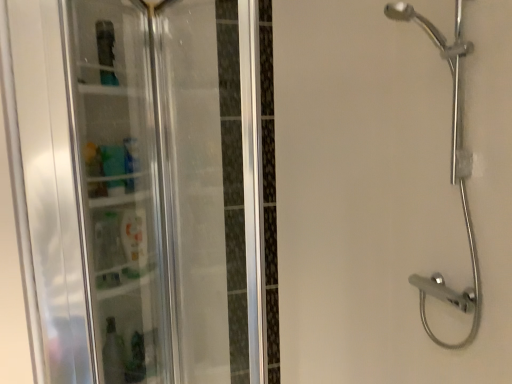
The image size is (512, 384). What do you see at coordinates (119, 186) in the screenshot?
I see `transparent plastic shelf at left` at bounding box center [119, 186].

Find the location of a particular element. transparent plastic shelf at left is located at coordinates (119, 186).

Measure the distance between transparent plastic shelf at left and camera.

transparent plastic shelf at left and camera are 3.75 feet apart.

The height and width of the screenshot is (384, 512). Describe the element at coordinates (450, 174) in the screenshot. I see `chrome metallic shower head at right` at that location.

At what (x,y) coordinates should I click in order to perform the action: click on chrome metallic shower head at right. Please return your answer as a coordinate pair (x, y). This screenshot has width=512, height=384. Looking at the image, I should click on (450, 174).

Locate an element on the screen. The height and width of the screenshot is (384, 512). transparent plastic shelf at left is located at coordinates (119, 186).

Which is more to the left, chrome metallic shower head at right or transparent plastic shelf at left?

transparent plastic shelf at left.

Based on the photo, is chrome metallic shower head at right in front of transparent plastic shelf at left?

No, it is behind transparent plastic shelf at left.

Which is farther from the camera, (462, 299) or (89, 254)?

The point (462, 299) is more distant.

From the image's perspective, who appears lower, chrome metallic shower head at right or transparent plastic shelf at left?

transparent plastic shelf at left.

From a real-world perspective, is chrome metallic shower head at right on top of transparent plastic shelf at left?

Correct, in the physical world, chrome metallic shower head at right is higher than transparent plastic shelf at left.

Which object is wider, chrome metallic shower head at right or transparent plastic shelf at left?

transparent plastic shelf at left is wider.

Does chrome metallic shower head at right have a lesser height compared to transparent plastic shelf at left?

No.

Considering the sizes of chrome metallic shower head at right and transparent plastic shelf at left in the image, is chrome metallic shower head at right bigger or smaller than transparent plastic shelf at left?

chrome metallic shower head at right is bigger than transparent plastic shelf at left.

Can we say chrome metallic shower head at right lies outside transparent plastic shelf at left?

Yes, chrome metallic shower head at right is outside of transparent plastic shelf at left.

Does chrome metallic shower head at right touch transparent plastic shelf at left?

No, chrome metallic shower head at right is not with transparent plastic shelf at left.

Could you tell me if chrome metallic shower head at right is facing transparent plastic shelf at left?

Yes.

What's the angular difference between chrome metallic shower head at right and transparent plastic shelf at left's facing directions?

The angular difference between chrome metallic shower head at right and transparent plastic shelf at left is 64.2 degrees.

Image resolution: width=512 pixels, height=384 pixels. Identify the location of screen door below the chrome metallic shower head at right (from the image's perspective). (119, 186).

Between transparent plastic shelf at left and chrome metallic shower head at right, which one appears on the left side from the viewer's perspective?

Positioned to the left is transparent plastic shelf at left.

Does transparent plastic shelf at left come in front of chrome metallic shower head at right?

Yes, transparent plastic shelf at left is closer to the viewer.

Which point is more forward, (72, 15) or (435, 336)?

Point (72, 15)

From the image's perspective, does transparent plastic shelf at left appear higher than chrome metallic shower head at right?

Incorrect, from the image's perspective, transparent plastic shelf at left is lower than chrome metallic shower head at right.

From a real-world perspective, which object stands above the other?

In real-world perspective, chrome metallic shower head at right is above.

Is transparent plastic shelf at left wider or thinner than chrome metallic shower head at right?

Clearly, transparent plastic shelf at left has more width compared to chrome metallic shower head at right.

Considering the sizes of objects transparent plastic shelf at left and chrome metallic shower head at right in the image provided, who is taller, transparent plastic shelf at left or chrome metallic shower head at right?

With more height is chrome metallic shower head at right.

Considering the relative sizes of transparent plastic shelf at left and chrome metallic shower head at right in the image provided, is transparent plastic shelf at left bigger than chrome metallic shower head at right?

No, transparent plastic shelf at left is not bigger than chrome metallic shower head at right.

Do you think transparent plastic shelf at left is within chrome metallic shower head at right, or outside of it?

transparent plastic shelf at left is outside chrome metallic shower head at right.

Is transparent plastic shelf at left placed right next to chrome metallic shower head at right?

transparent plastic shelf at left and chrome metallic shower head at right are clearly separated.

Does transparent plastic shelf at left turn towards chrome metallic shower head at right?

No, transparent plastic shelf at left is not aimed at chrome metallic shower head at right.

What's the angular difference between transparent plastic shelf at left and chrome metallic shower head at right's facing directions?

The angle between the facing direction of transparent plastic shelf at left and the facing direction of chrome metallic shower head at right is 64.2 degrees.

This screenshot has height=384, width=512. Identify the location of screen door that is in front of the chrome metallic shower head at right. (119, 186).

The height and width of the screenshot is (384, 512). Identify the location of screen door in front of the chrome metallic shower head at right. (119, 186).

Where is `shower above the transparent plastic shelf at left (from a real-world perspective)`? The width and height of the screenshot is (512, 384). shower above the transparent plastic shelf at left (from a real-world perspective) is located at coordinates (450, 174).